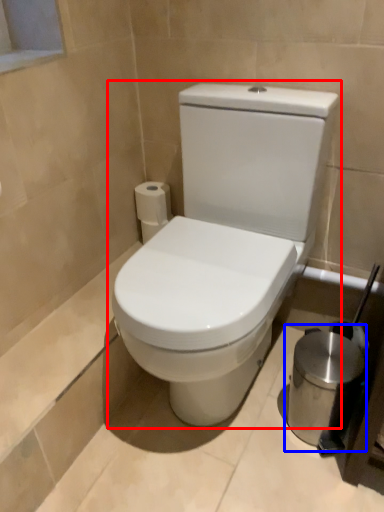
Question: Among these objects, which one is farthest to the camera, toilet (highlighted by a red box) or appliance (highlighted by a blue box)?

Choices:
 (A) toilet
 (B) appliance

Answer: (B)